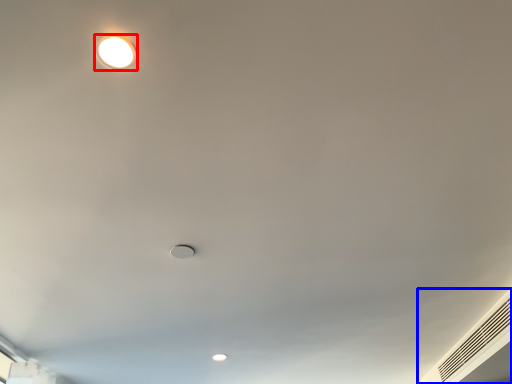
Question: Among these objects, which one is nearest to the camera, lamp (highlighted by a red box) or air conditioning (highlighted by a blue box)?

Choices:
 (A) lamp
 (B) air conditioning

Answer: (A)